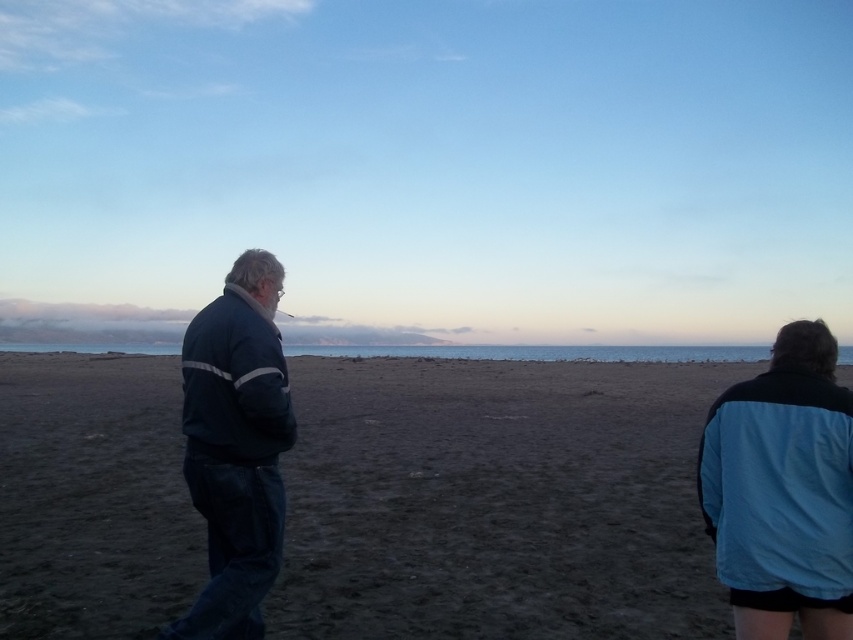
Question: Which point is closer to the camera taking this photo?

Choices:
 (A) (822, 397)
 (B) (476, 564)
 (C) (198, 492)

Answer: (A)

Question: Does blue fabric jacket at lower right appear on the right side of dark blue fabric jacket at left?

Choices:
 (A) no
 (B) yes

Answer: (B)

Question: Is blue fabric jacket at lower right below dark blue fabric jacket at left?

Choices:
 (A) no
 (B) yes

Answer: (B)

Question: Is dark sand at center further to camera compared to dark blue fabric jacket at left?

Choices:
 (A) yes
 (B) no

Answer: (A)

Question: Which of these objects is positioned farthest from the dark blue fabric jacket at left?

Choices:
 (A) dark sand at center
 (B) blue fabric jacket at lower right

Answer: (A)

Question: Which of these objects is positioned closest to the dark sand at center?

Choices:
 (A) dark blue fabric jacket at left
 (B) blue fabric jacket at lower right

Answer: (B)